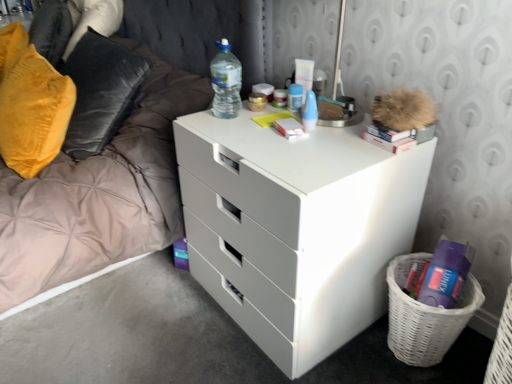
The width and height of the screenshot is (512, 384). In order to click on vacant space situated on the left part of blue plastic spray can at upper center, the first toiletry from the front in this screenshot , I will do `click(257, 119)`.